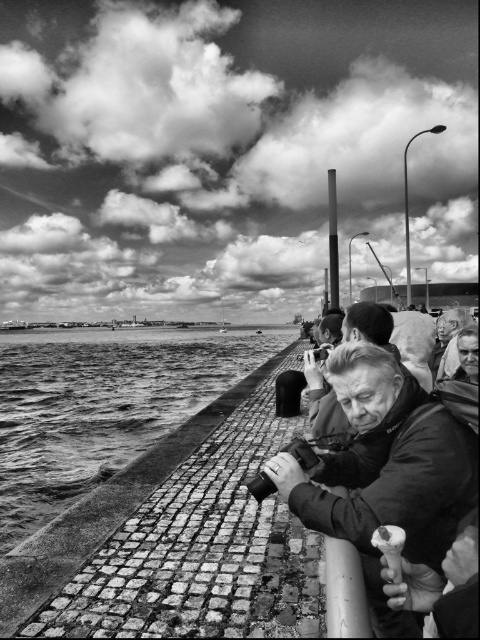
Question: Which is farther from the rough stone water at lower left?

Choices:
 (A) matte black camera at center
 (B) smooth leather jacket at center

Answer: (B)

Question: Is rough stone water at lower left smaller than smooth leather jacket at center?

Choices:
 (A) yes
 (B) no

Answer: (B)

Question: Which of the following is the closest to the observer?

Choices:
 (A) (360, 337)
 (B) (377, 557)
 (C) (4, 516)

Answer: (B)

Question: Considering the relative positions of rough stone water at lower left and smooth leather jacket at center in the image provided, where is rough stone water at lower left located with respect to smooth leather jacket at center?

Choices:
 (A) above
 (B) below

Answer: (B)

Question: Considering the relative positions of rough stone water at lower left and matte black camera at center in the image provided, where is rough stone water at lower left located with respect to matte black camera at center?

Choices:
 (A) below
 (B) above

Answer: (A)

Question: Among these points, which one is nearest to the camera?

Choices:
 (A) (381, 314)
 (B) (48, 458)

Answer: (A)